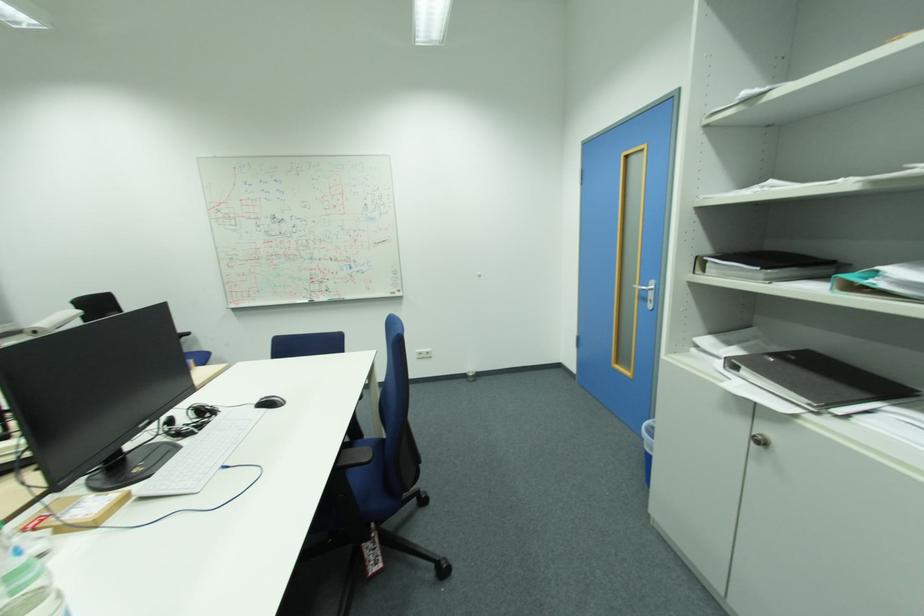
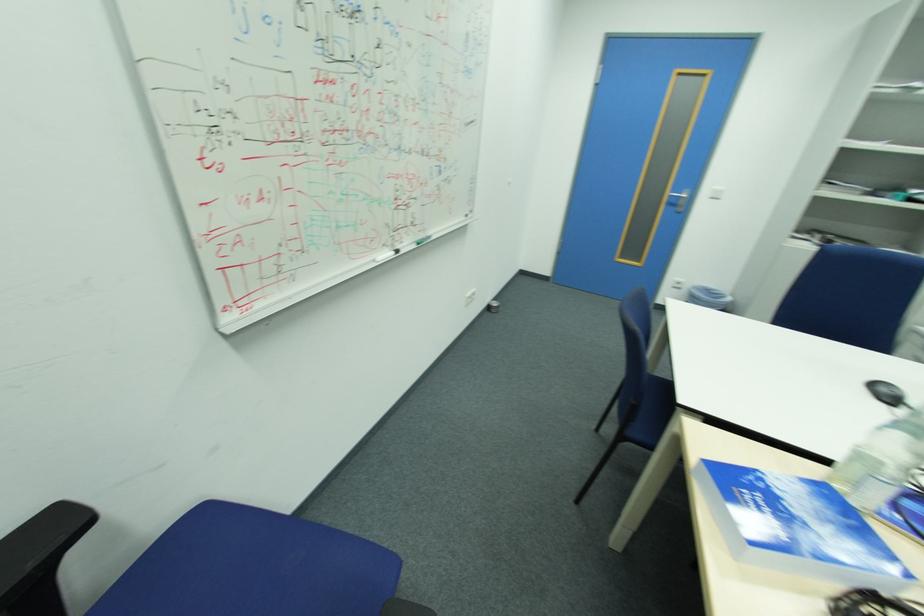
The point at (312, 302) is marked in the first image. Where is the corresponding point in the second image?

(396, 256)